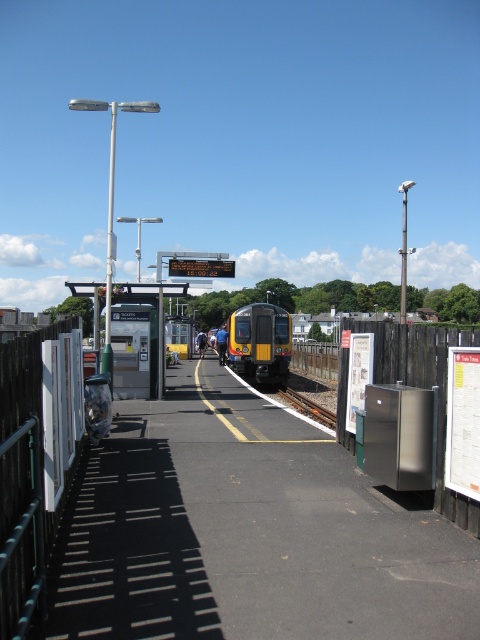
Question: Can you confirm if yellow matte train at center is wider than brown wooden train track at center?

Choices:
 (A) yes
 (B) no

Answer: (A)

Question: Does yellow matte train at center have a larger size compared to brown wooden train track at center?

Choices:
 (A) no
 (B) yes

Answer: (B)

Question: In this image, where is yellow matte train at center located relative to brown wooden train track at center?

Choices:
 (A) right
 (B) left

Answer: (B)

Question: Which point is closer to the camera taking this photo?

Choices:
 (A) (238, 326)
 (B) (335, 426)

Answer: (B)